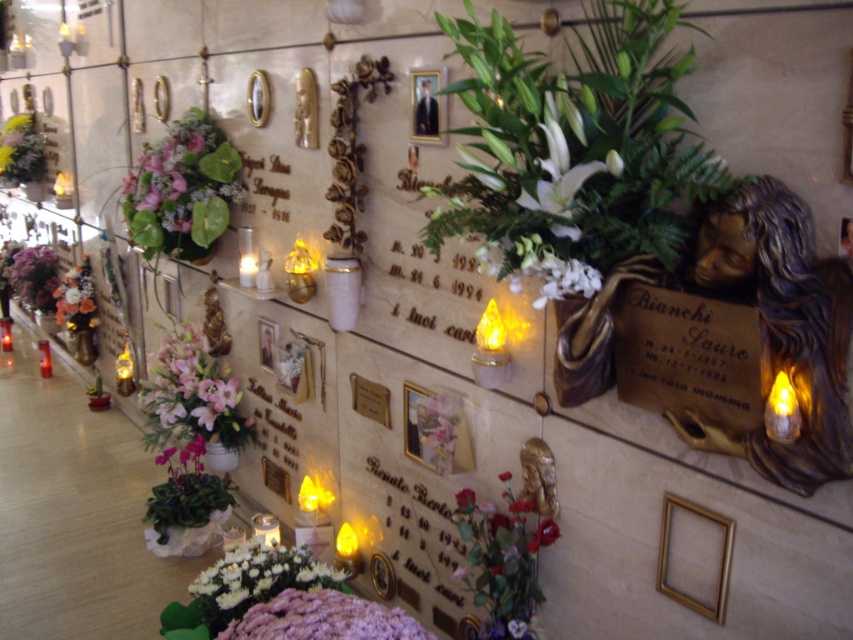
Does pink silk flowers at lower left have a lesser width compared to white matte flowers at lower center?

In fact, pink silk flowers at lower left might be wider than white matte flowers at lower center.

Which is below, pink silk flowers at lower left or white matte flowers at lower center?

Positioned lower is white matte flowers at lower center.

Locate an element on the screen. Image resolution: width=853 pixels, height=640 pixels. pink silk flowers at lower left is located at coordinates (190, 429).

Where is `pink silk flowers at lower left`? pink silk flowers at lower left is located at coordinates (190, 429).

Is pink silk flowers at lower left wider than white matte flowers at center?

Yes.

Between point (166, 513) and point (569, 291), which one is positioned in front?

Point (569, 291)

The width and height of the screenshot is (853, 640). Find the location of `pink silk flowers at lower left`. pink silk flowers at lower left is located at coordinates (190, 429).

Between white glossy flowers at upper center and matte gold picture frame at center, which one is positioned higher?

white glossy flowers at upper center is higher up.

Is white glossy flowers at upper center to the right of matte gold picture frame at center from the viewer's perspective?

Yes, white glossy flowers at upper center is to the right of matte gold picture frame at center.

Does point (711, 196) come closer to viewer compared to point (267, 342)?

Yes, it is in front of point (267, 342).

Locate an element on the screen. This screenshot has height=640, width=853. white glossy flowers at upper center is located at coordinates (573, 150).